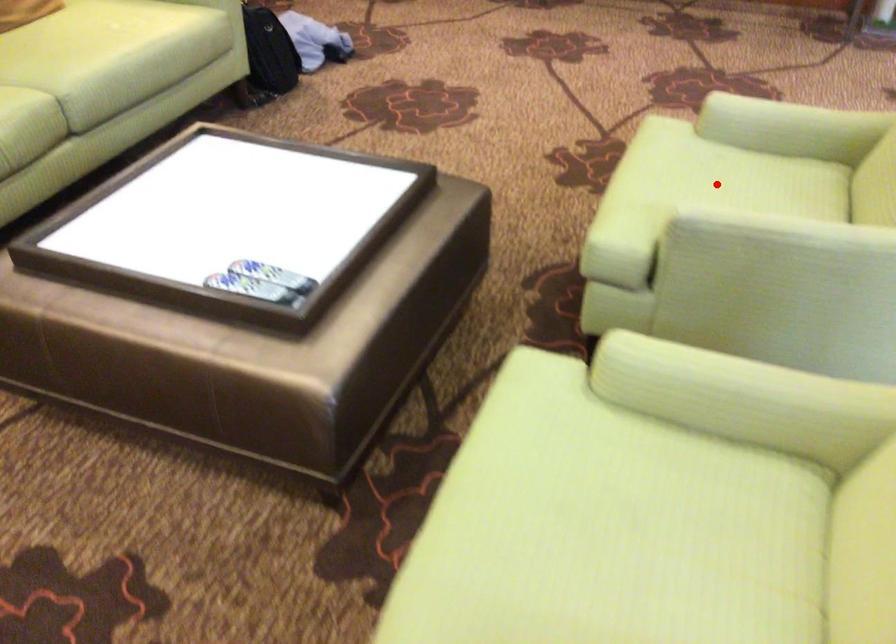
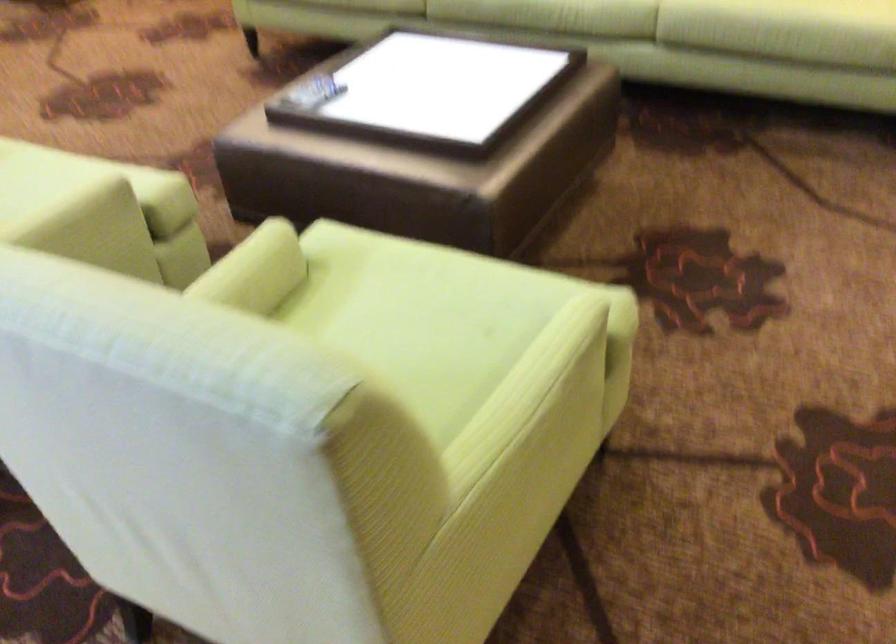
Question: I am providing you with two images of the same scene from different viewpoints. Image1 has a red point marked. In image2, the corresponding 3D location appears at what relative position? Reply with the corresponding letter.

Choices:
 (A) Closer
 (B) Farther

Answer: (A)